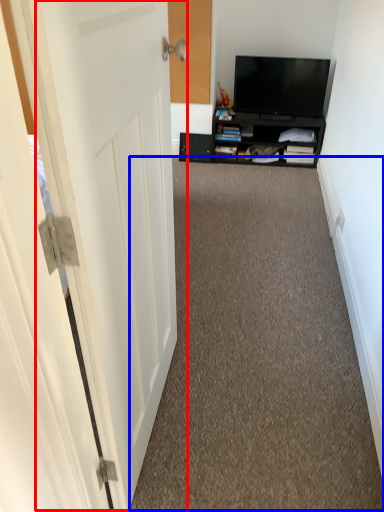
Question: Which of the following is the farthest to the observer, door (highlighted by a red box) or corridor (highlighted by a blue box)?

Choices:
 (A) door
 (B) corridor

Answer: (B)